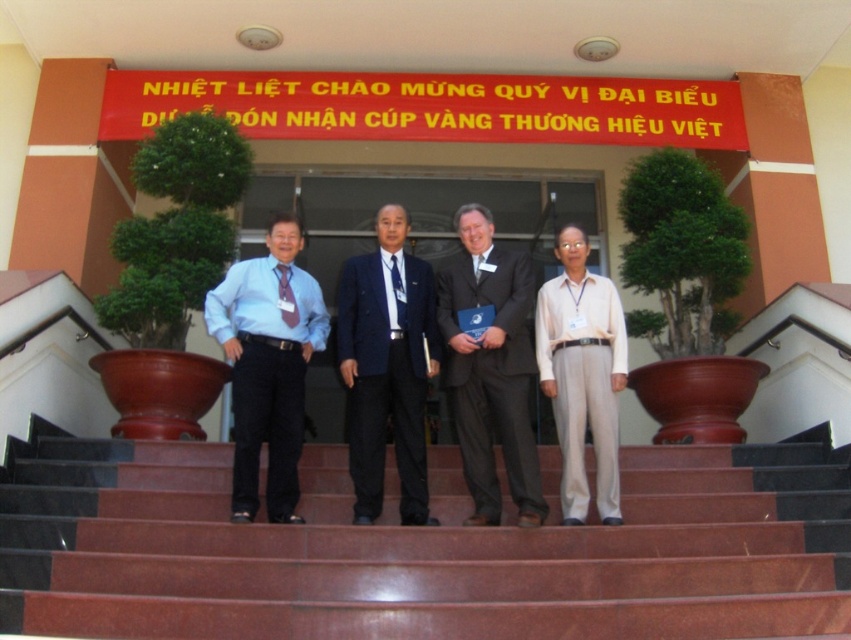
Between navy blue wool suit at center and beige cotton pants at center, which one has less height?

With less height is navy blue wool suit at center.

Does navy blue wool suit at center appear over beige cotton pants at center?

Incorrect, navy blue wool suit at center is not positioned above beige cotton pants at center.

From the picture: Measure the distance between point (398,346) and camera.

Point (398,346) is 7.50 meters away from camera.

Where is `navy blue wool suit at center`? The height and width of the screenshot is (640, 851). navy blue wool suit at center is located at coordinates (386, 378).

Looking at this image, which of these two, marble stairs at center or navy blue wool suit at center, stands shorter?

Standing shorter between the two is marble stairs at center.

Can you confirm if marble stairs at center is positioned to the right of navy blue wool suit at center?

Incorrect, marble stairs at center is not on the right side of navy blue wool suit at center.

Between point (829, 522) and point (387, 371), which one is positioned in front?

Positioned in front is point (829, 522).

The image size is (851, 640). In order to click on marble stairs at center in this screenshot , I will do `click(420, 550)`.

Measure the distance between point (697, 582) and camera.

Point (697, 582) is 5.98 meters from camera.

Is point (494, 552) closer to camera compared to point (277, 291)?

Yes, point (494, 552) is in front of point (277, 291).

You are a GUI agent. You are given a task and a screenshot of the screen. Output one action in this format:
    pyautogui.click(x=<x>, y=<y>)
    Task: Click on the marble stairs at center
    The width and height of the screenshot is (851, 640).
    Given the screenshot: What is the action you would take?
    420,550

The image size is (851, 640). I want to click on marble stairs at center, so click(420, 550).